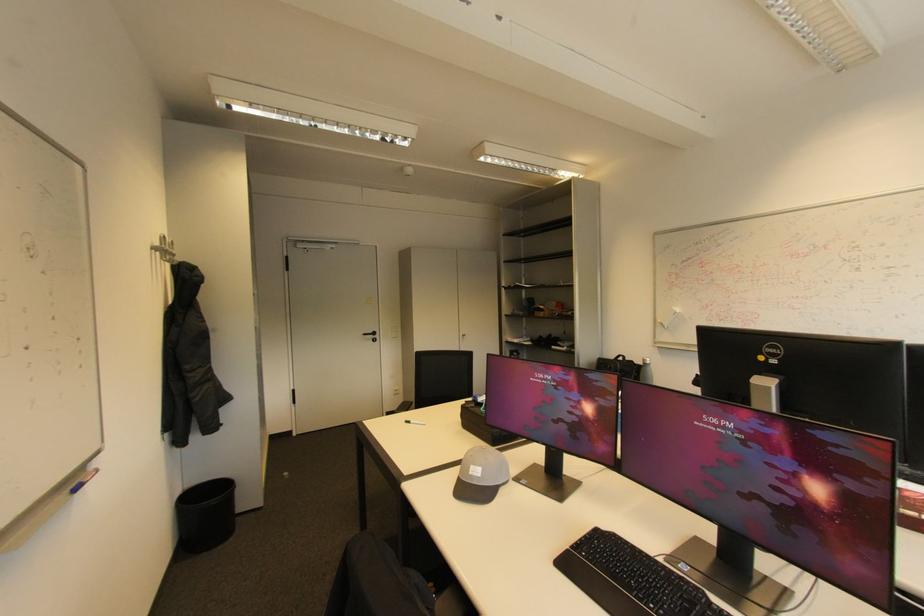
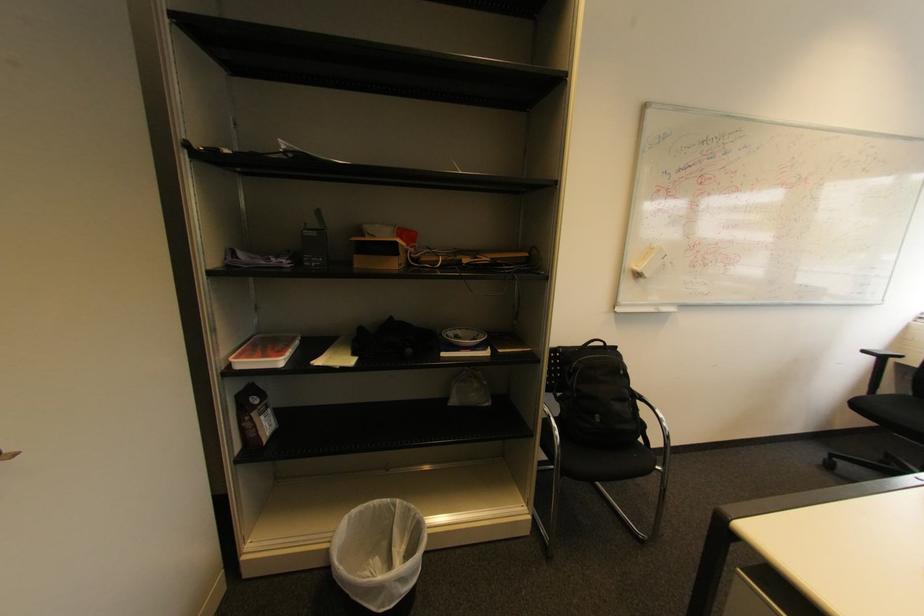
In the second image, find the point that corresponds to point 546,310 in the first image.

(395, 251)